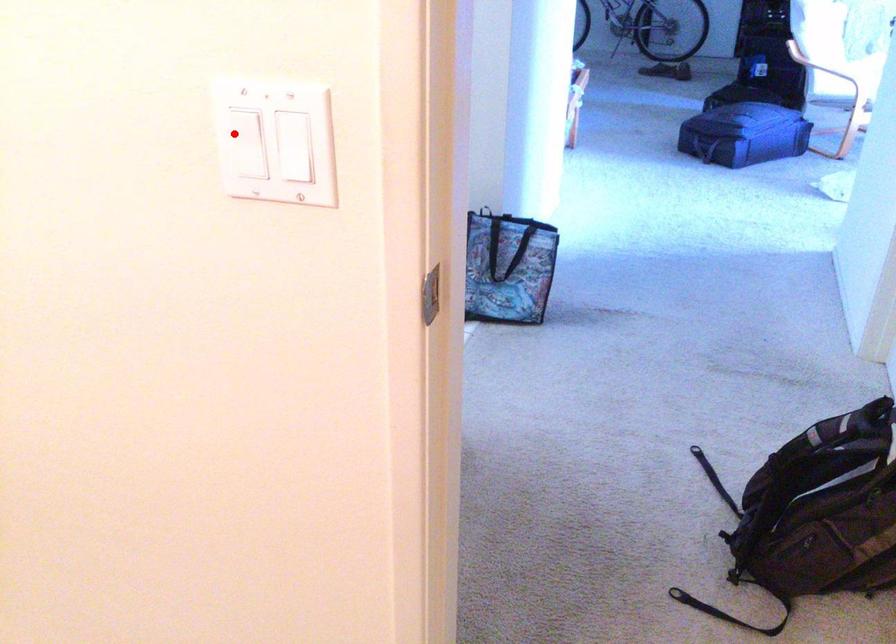
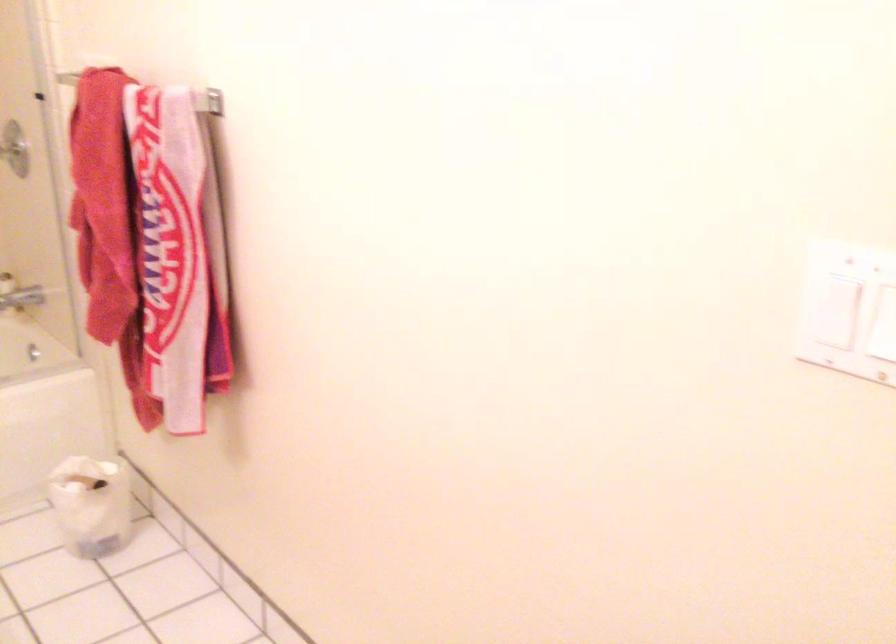
Question: I am providing you with two images of the same scene from different viewpoints. A red point is marked on the first image. Is the red point's position out of view in image 2?

Choices:
 (A) Yes
 (B) No

Answer: (B)